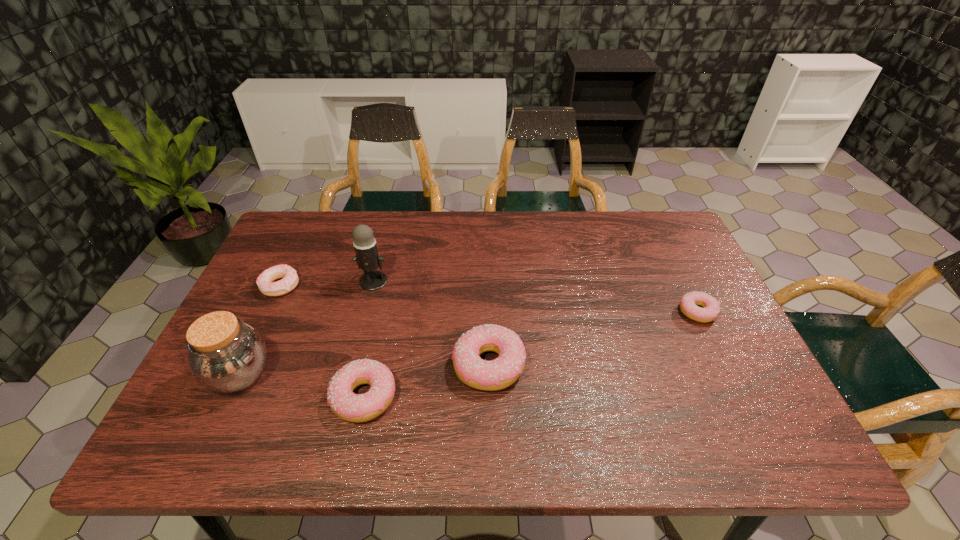
To achieve even spacing by inserting another doughnut among them, please point to a vacant spot for this new doughnut. Please provide its 2D coordinates. Your answer should be formatted as a tuple, i.e. [(x, y)], where the tuple contains the x and y coordinates of a point satisfying the conditions above.

[(599, 337)]